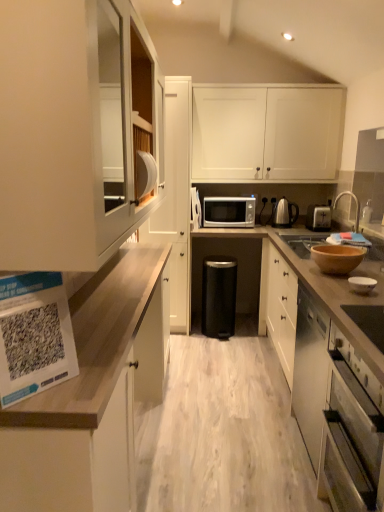
Question: Does white matte cabinet at upper center, which ranks as the 1th cabinetry in right-to-left order, lie in front of silver metallic toaster at right?

Choices:
 (A) no
 (B) yes

Answer: (A)

Question: Can you confirm if white matte cabinet at upper center, the fourth cabinetry in the left-to-right sequence, is taller than silver metallic toaster at right?

Choices:
 (A) yes
 (B) no

Answer: (A)

Question: Is there a large distance between white matte cabinet at upper center, the fourth cabinetry in the left-to-right sequence, and silver metallic toaster at right?

Choices:
 (A) no
 (B) yes

Answer: (A)

Question: Can you confirm if white matte cabinet at upper center, which ranks as the 1th cabinetry in right-to-left order, is smaller than silver metallic toaster at right?

Choices:
 (A) no
 (B) yes

Answer: (A)

Question: From the image's perspective, is white matte cabinet at upper center, which ranks as the 1th cabinetry in right-to-left order, under silver metallic toaster at right?

Choices:
 (A) yes
 (B) no

Answer: (B)

Question: Would you say white matte cabinet at upper center, which ranks as the 1th cabinetry in right-to-left order, is inside or outside polished stainless steel kettle at center-right, the first appliance when ordered from right to left?

Choices:
 (A) outside
 (B) inside

Answer: (A)

Question: Visually, is white matte cabinet at upper center, which ranks as the 1th cabinetry in right-to-left order, positioned to the left or to the right of polished stainless steel kettle at center-right, which appears as the second appliance when viewed from the left?

Choices:
 (A) right
 (B) left

Answer: (B)

Question: Considering the positions of white matte cabinet at upper center, the fourth cabinetry in the left-to-right sequence, and polished stainless steel kettle at center-right, the first appliance when ordered from right to left, in the image, is white matte cabinet at upper center, the fourth cabinetry in the left-to-right sequence, bigger or smaller than polished stainless steel kettle at center-right, the first appliance when ordered from right to left,?

Choices:
 (A) small
 (B) big

Answer: (B)

Question: Considering their positions, is white matte cabinet at upper center, the fourth cabinetry in the left-to-right sequence, located in front of or behind polished stainless steel kettle at center-right, which appears as the second appliance when viewed from the left?

Choices:
 (A) behind
 (B) front

Answer: (B)

Question: Considering the positions of black matte trash can at center and white matte microwave at center, which is the 2th appliance from right to left, in the image, is black matte trash can at center bigger or smaller than white matte microwave at center, which is the 2th appliance from right to left,?

Choices:
 (A) small
 (B) big

Answer: (B)

Question: In terms of width, does black matte trash can at center look wider or thinner when compared to white matte microwave at center, positioned as the first appliance in left-to-right order?

Choices:
 (A) wide
 (B) thin

Answer: (B)

Question: From the image's perspective, relative to white matte microwave at center, positioned as the first appliance in left-to-right order, is black matte trash can at center above or below?

Choices:
 (A) below
 (B) above

Answer: (A)

Question: From a real-world perspective, relative to white matte microwave at center, which is the 2th appliance from right to left, is black matte trash can at center vertically above or below?

Choices:
 (A) below
 (B) above

Answer: (A)

Question: Considering their positions, is silver metallic microwave at center located in front of or behind brown matte bowl at right?

Choices:
 (A) behind
 (B) front

Answer: (A)

Question: From the image's perspective, is silver metallic microwave at center above or below brown matte bowl at right?

Choices:
 (A) above
 (B) below

Answer: (A)